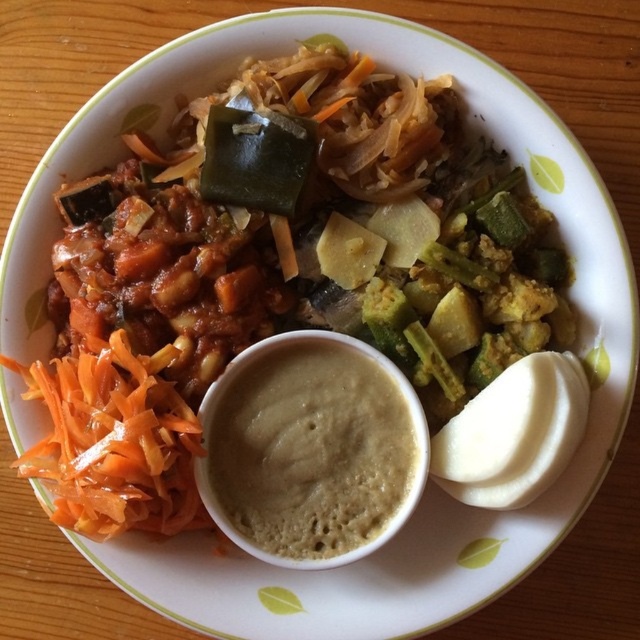
Does smooth beige dip at center appear on the left side of orange shredded carrot at lower left?

In fact, smooth beige dip at center is to the right of orange shredded carrot at lower left.

Is smooth beige dip at center shorter than orange shredded carrot at lower left?

In fact, smooth beige dip at center may be taller than orange shredded carrot at lower left.

Locate an element on the screen. smooth beige dip at center is located at coordinates (310, 449).